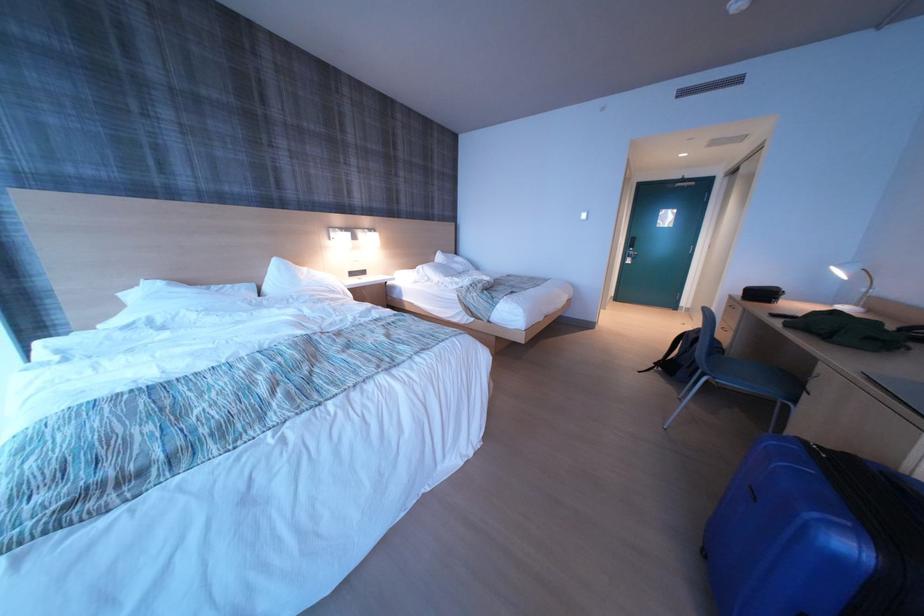
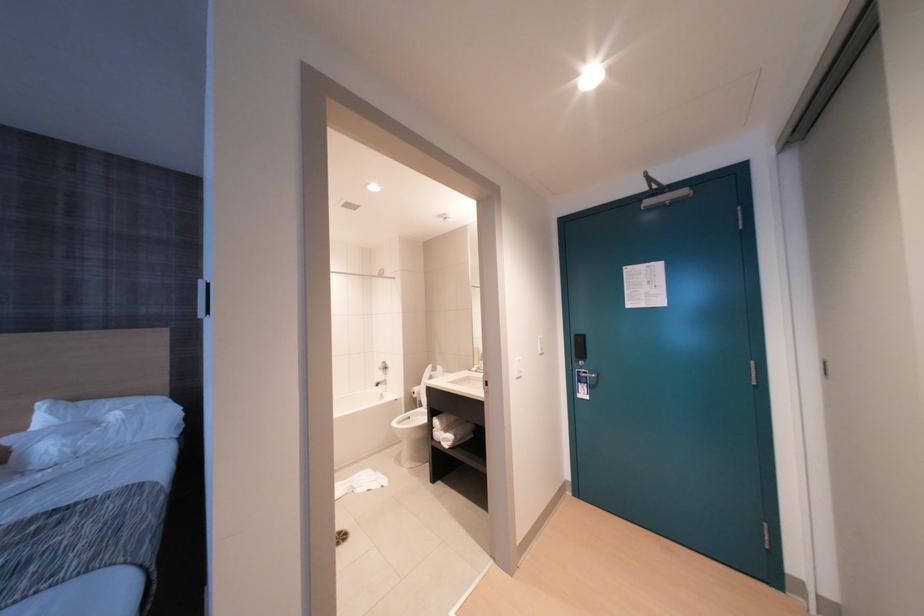
In a continuous first-person perspective shot, in which direction is the camera moving?

The cameraman moved toward right, forward.